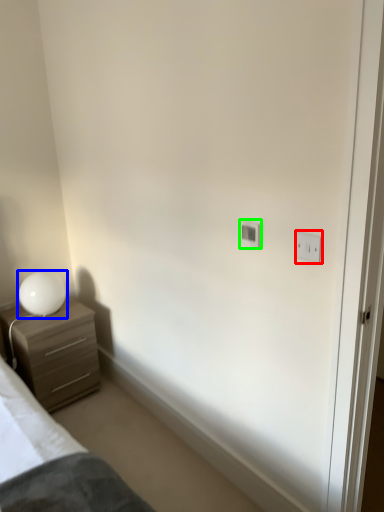
Question: Based on their relative distances, which object is nearer to light switch (highlighted by a red box)? Choose from table lamp (highlighted by a blue box) and light switch (highlighted by a green box).

Choices:
 (A) table lamp
 (B) light switch

Answer: (B)